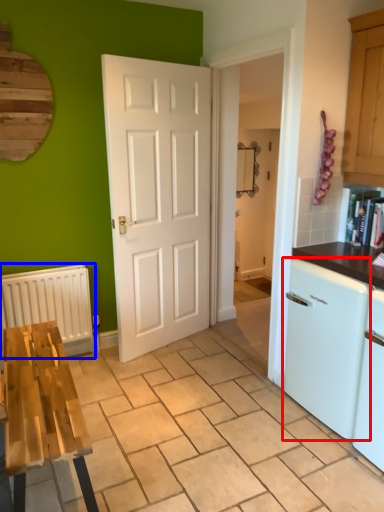
Question: Among these objects, which one is farthest to the camera, dish washer (highlighted by a red box) or radiator (highlighted by a blue box)?

Choices:
 (A) dish washer
 (B) radiator

Answer: (B)